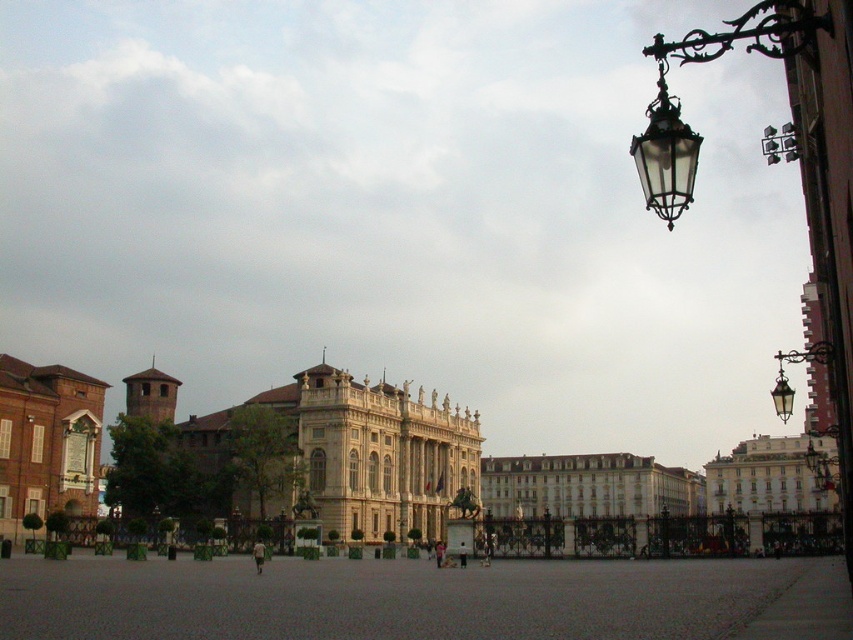
Can you confirm if beige stone palace at center is positioned below brick wall at left?

Yes.

Is point (285, 506) positioned in front of point (9, 394)?

That is False.

Where is `beige stone palace at center`? beige stone palace at center is located at coordinates (354, 454).

Is point (415, 440) positioned before point (527, 504)?

Yes, point (415, 440) is closer to viewer.

Does beige stone palace at center appear on the right side of white glossy building at center?

Incorrect, beige stone palace at center is not on the right side of white glossy building at center.

The width and height of the screenshot is (853, 640). What do you see at coordinates (354, 454) in the screenshot? I see `beige stone palace at center` at bounding box center [354, 454].

At what (x,y) coordinates should I click in order to perform the action: click on beige stone palace at center. Please return your answer as a coordinate pair (x, y). The image size is (853, 640). Looking at the image, I should click on (354, 454).

Is point (672, 467) positioned behind point (62, 460)?

Yes, point (672, 467) is behind point (62, 460).

Is point (672, 499) in front of point (16, 371)?

No, (672, 499) is behind (16, 371).

Locate an element on the screen. Image resolution: width=853 pixels, height=640 pixels. white glossy building at center is located at coordinates (581, 500).